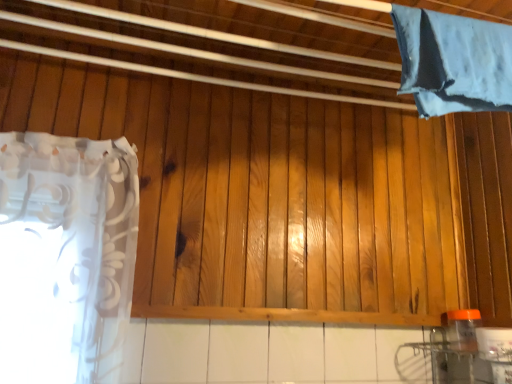
Question: Is blue fabric at upper right, acting as the second curtain starting from the bottom, completely or partially inside orange translucent bottle at lower right?

Choices:
 (A) no
 (B) yes

Answer: (A)

Question: Does orange translucent bottle at lower right touch blue fabric at upper right, placed as the 2th curtain when sorted from left to right?

Choices:
 (A) yes
 (B) no

Answer: (B)

Question: Considering the relative sizes of orange translucent bottle at lower right and blue fabric at upper right, placed as the 2th curtain when sorted from left to right, in the image provided, is orange translucent bottle at lower right thinner than blue fabric at upper right, placed as the 2th curtain when sorted from left to right,?

Choices:
 (A) yes
 (B) no

Answer: (A)

Question: From the image's perspective, is orange translucent bottle at lower right above blue fabric at upper right, acting as the second curtain starting from the bottom?

Choices:
 (A) no
 (B) yes

Answer: (A)

Question: Is orange translucent bottle at lower right far away from blue fabric at upper right, placed as the 2th curtain when sorted from left to right?

Choices:
 (A) no
 (B) yes

Answer: (A)

Question: Is orange translucent bottle at lower right shorter than blue fabric at upper right, placed as the 2th curtain when sorted from left to right?

Choices:
 (A) no
 (B) yes

Answer: (B)

Question: Does white sheer curtain at left, the second curtain from the top, have a larger size compared to blue fabric at upper right, the 1th curtain from the top?

Choices:
 (A) no
 (B) yes

Answer: (B)

Question: Is the position of white sheer curtain at left, acting as the second curtain starting from the right, less distant than that of blue fabric at upper right, which appears as the 1th curtain when viewed from the right?

Choices:
 (A) yes
 (B) no

Answer: (B)

Question: Is white sheer curtain at left, arranged as the 1th curtain when viewed from the left, located outside blue fabric at upper right, the 1th curtain from the top?

Choices:
 (A) yes
 (B) no

Answer: (A)

Question: Is white sheer curtain at left, the second curtain from the top, taller than blue fabric at upper right, acting as the second curtain starting from the bottom?

Choices:
 (A) yes
 (B) no

Answer: (A)

Question: From the image's perspective, is white sheer curtain at left, acting as the second curtain starting from the right, under blue fabric at upper right, placed as the 2th curtain when sorted from left to right?

Choices:
 (A) no
 (B) yes

Answer: (B)

Question: Can you confirm if white sheer curtain at left, arranged as the 1th curtain when viewed from the left, is thinner than blue fabric at upper right, acting as the second curtain starting from the bottom?

Choices:
 (A) no
 (B) yes

Answer: (A)

Question: Is blue fabric at upper right, acting as the second curtain starting from the bottom, thinner than orange translucent bottle at lower right?

Choices:
 (A) yes
 (B) no

Answer: (B)